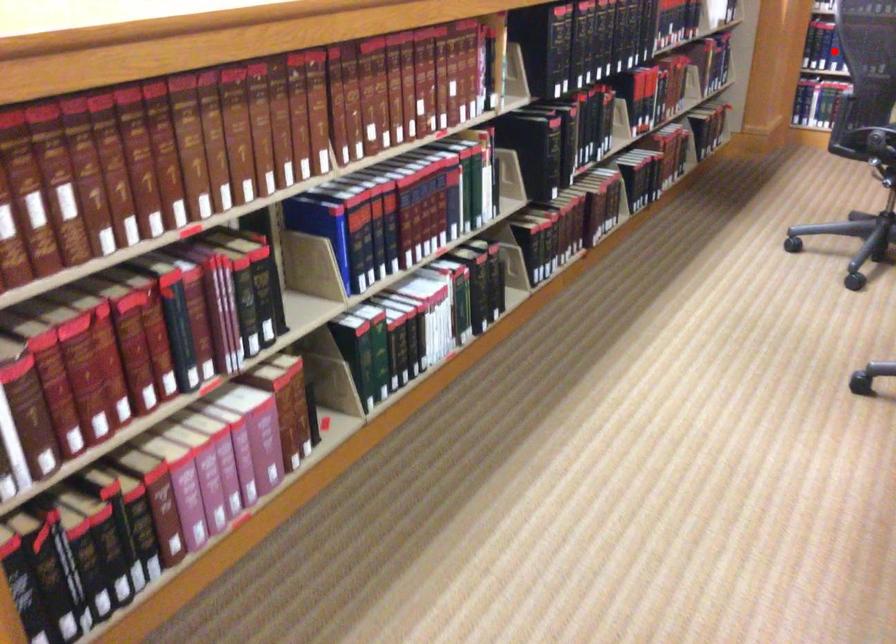
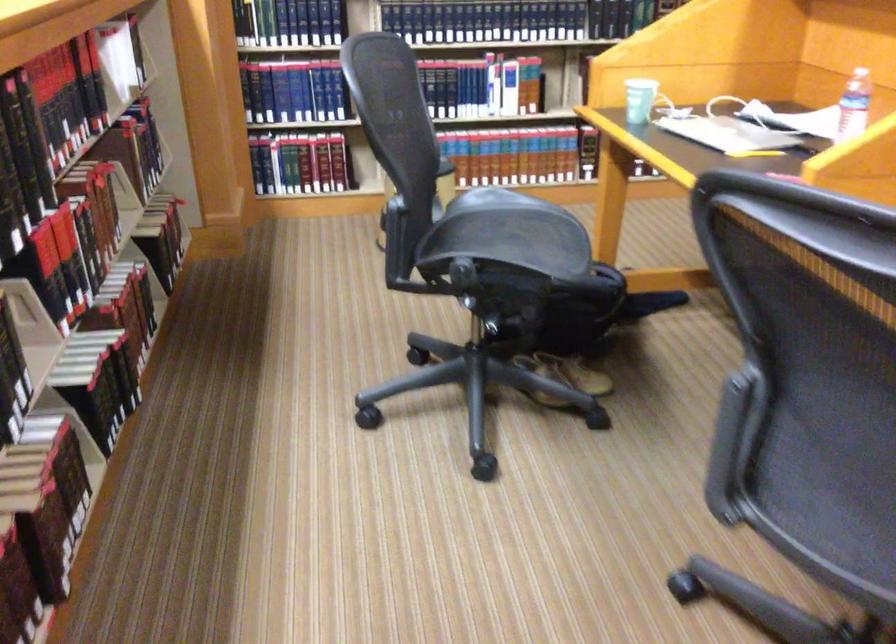
Question: I am providing you with two images of the same scene from different viewpoints. A red point is marked on the first image. At the location where the point appears in image 1, is it still visible in image 2?

Choices:
 (A) Yes
 (B) No

Answer: (B)